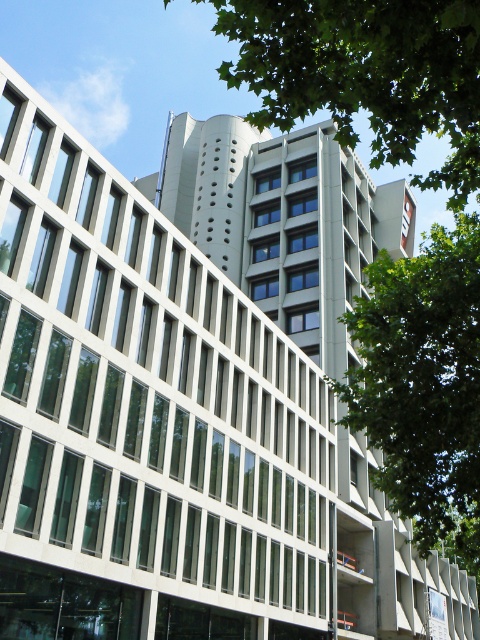
Between point (322, 3) and point (431, 433), which one is positioned behind?

The point (431, 433) is behind.

From the picture: Can you confirm if green leafy tree at upper center is wider than green leafy tree at right?

No, green leafy tree at upper center is not wider than green leafy tree at right.

Between point (456, 44) and point (460, 298), which one is positioned behind?

The point (460, 298) is behind.

At what (x,y) coordinates should I click in order to perform the action: click on green leafy tree at upper center. Please return your answer as a coordinate pair (x, y). This screenshot has width=480, height=640. Looking at the image, I should click on (365, 74).